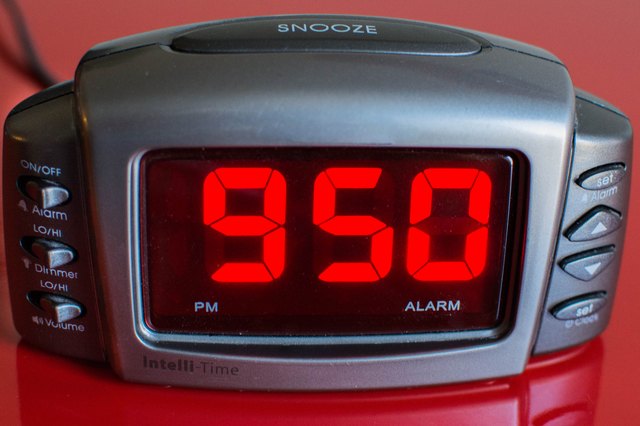
In order to click on alarm in this screenshot , I will do `click(242, 91)`.